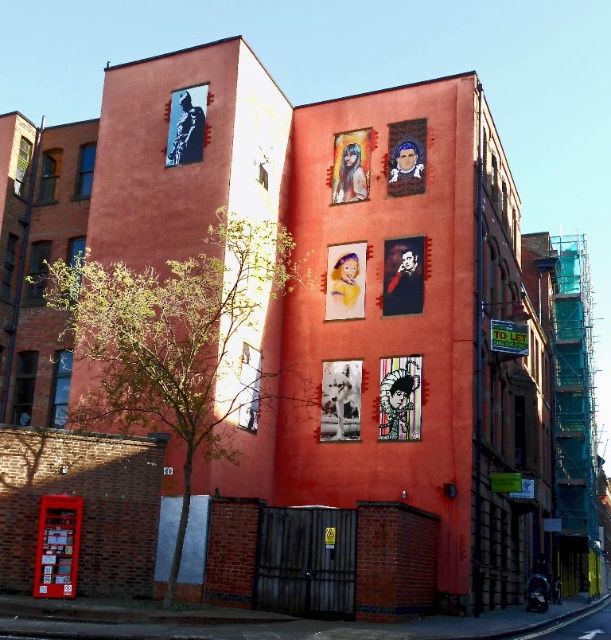
Question: Which object is the farthest from the white paper poster at center?

Choices:
 (A) matte paper poster at upper center
 (B) pastel yellow paper at center

Answer: (A)

Question: Among these points, which one is farthest from the camera?

Choices:
 (A) (348, 292)
 (B) (360, 129)

Answer: (B)

Question: Which object appears closest to the camera in this image?

Choices:
 (A) white paper poster at center
 (B) matte paper poster at upper center
 (C) matte black portrait at upper center
 (D) colorful paper poster at center

Answer: (D)

Question: Is colorful paper poster at center smaller than pastel yellow paper at center?

Choices:
 (A) no
 (B) yes

Answer: (B)

Question: Is white paper poster at center thinner than pastel yellow paper at center?

Choices:
 (A) no
 (B) yes

Answer: (B)

Question: Is matte black portrait at upper center thinner than matte paper poster at upper center?

Choices:
 (A) no
 (B) yes

Answer: (B)